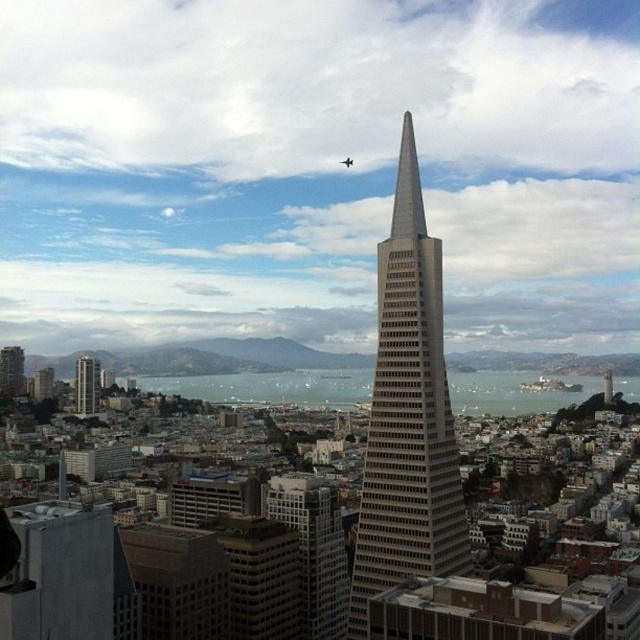
Question: Does gray concrete building at left come behind matte gray building at left?

Choices:
 (A) yes
 (B) no

Answer: (B)

Question: Which point is farther to the camera?

Choices:
 (A) gray concrete building at left
 (B) gray concrete skyscraper at center
 (C) matte gray building at left

Answer: (C)

Question: Is gray concrete building at left positioned in front of matte gray building at left?

Choices:
 (A) yes
 (B) no

Answer: (A)

Question: Which point is farther to the camera?

Choices:
 (A) gray concrete skyscraper at center
 (B) matte gray building at left

Answer: (B)

Question: Does gray concrete skyscraper at center have a greater width compared to gray concrete building at left?

Choices:
 (A) yes
 (B) no

Answer: (A)

Question: Which of the following is the farthest from the observer?

Choices:
 (A) (4, 355)
 (B) (93, 397)

Answer: (A)